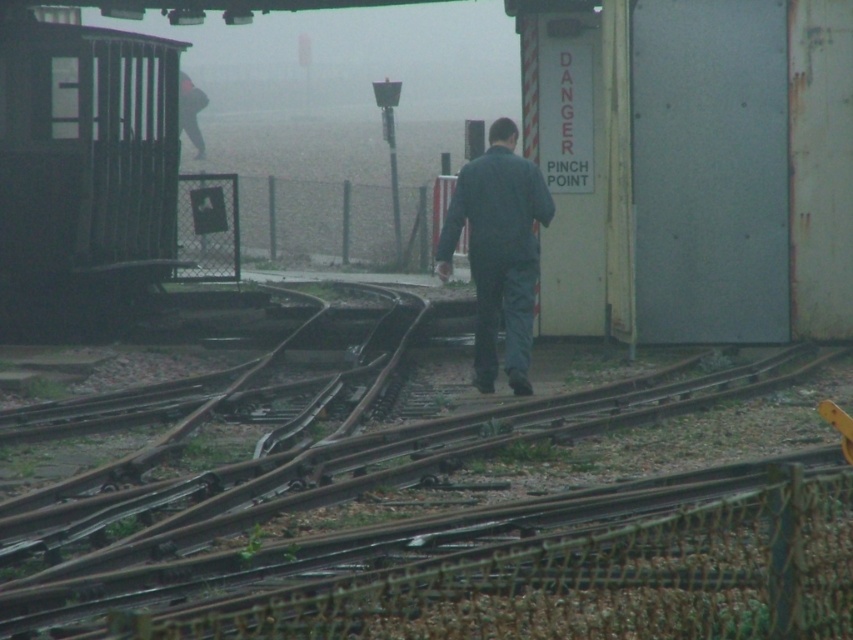
Does rusty metal tracks at center have a lesser width compared to dark gray metal train at left?

No.

The image size is (853, 640). Describe the element at coordinates (440, 528) in the screenshot. I see `rusty metal tracks at center` at that location.

This screenshot has width=853, height=640. Find the location of `rusty metal tracks at center`. rusty metal tracks at center is located at coordinates (440, 528).

Find the location of `rusty metal tracks at center`. rusty metal tracks at center is located at coordinates (440, 528).

Does dark gray metal train at left lie behind dark blue fabric at center?

Yes, it is behind dark blue fabric at center.

Is dark gray metal train at left to the right of dark blue fabric at center from the viewer's perspective?

No, dark gray metal train at left is not to the right of dark blue fabric at center.

This screenshot has width=853, height=640. In order to click on dark gray metal train at left in this screenshot , I will do `click(83, 173)`.

Which is in front, point (538, 416) or point (492, 225)?

Positioned in front is point (538, 416).

This screenshot has height=640, width=853. Find the location of `rusty metal tracks at center`. rusty metal tracks at center is located at coordinates (440, 528).